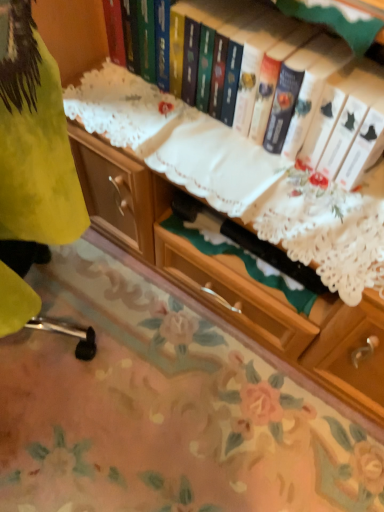
Question: Looking at the image, does floral-patterned fabric at lower center seem bigger or smaller compared to hardcover book at upper center?

Choices:
 (A) small
 (B) big

Answer: (B)

Question: Is point (8, 422) closer or farther from the camera than point (200, 0)?

Choices:
 (A) closer
 (B) farther

Answer: (B)

Question: Which is correct: floral-patterned fabric at lower center is inside hardcover book at upper center, or outside of it?

Choices:
 (A) inside
 (B) outside

Answer: (B)

Question: Considering the positions of hardcover book at upper center and floral-patterned fabric at lower center in the image, is hardcover book at upper center taller or shorter than floral-patterned fabric at lower center?

Choices:
 (A) tall
 (B) short

Answer: (A)

Question: In terms of width, does hardcover book at upper center look wider or thinner when compared to floral-patterned fabric at lower center?

Choices:
 (A) wide
 (B) thin

Answer: (B)

Question: Looking at the image, does hardcover book at upper center seem bigger or smaller compared to floral-patterned fabric at lower center?

Choices:
 (A) big
 (B) small

Answer: (B)

Question: Is hardcover book at upper center in front of or behind floral-patterned fabric at lower center in the image?

Choices:
 (A) behind
 (B) front

Answer: (B)